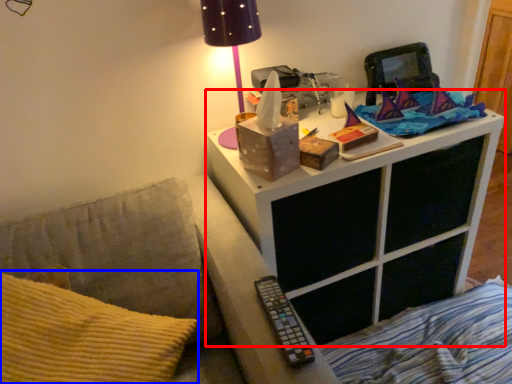
Question: Which of the following is the farthest to the observer, nightstand (highlighted by a red box) or throw pillow (highlighted by a blue box)?

Choices:
 (A) nightstand
 (B) throw pillow

Answer: (A)